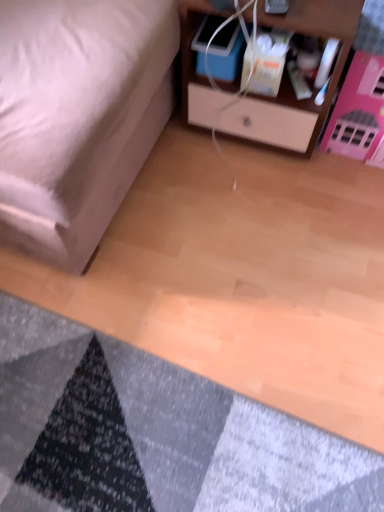
What is the approximate width of wooden nightstand at upper right?

The width of wooden nightstand at upper right is 15.46 inches.

Locate an element on the screen. The image size is (384, 512). textured gray mat at lower left is located at coordinates (156, 433).

At what (x,y) coordinates should I click in order to perform the action: click on wooden nightstand at upper right. Please return your answer as a coordinate pair (x, y). The image size is (384, 512). Looking at the image, I should click on (290, 83).

Is wooden nightstand at upper right positioned in front of textured gray mat at lower left?

No, the depth of wooden nightstand at upper right is greater than that of textured gray mat at lower left.

Considering the points (248, 100) and (38, 367), which point is behind, point (248, 100) or point (38, 367)?

The point (248, 100) is behind.

Consider the image. Does wooden nightstand at upper right have a smaller size compared to textured gray mat at lower left?

Actually, wooden nightstand at upper right might be larger than textured gray mat at lower left.

In terms of width, does wooden nightstand at upper right look wider or thinner when compared to matte white bed at lower left?

Considering their sizes, wooden nightstand at upper right looks slimmer than matte white bed at lower left.

Is wooden nightstand at upper right inside the boundaries of matte white bed at lower left, or outside?

wooden nightstand at upper right exists outside the volume of matte white bed at lower left.

Is wooden nightstand at upper right directly adjacent to matte white bed at lower left?

wooden nightstand at upper right is not next to matte white bed at lower left, and they're not touching.

From a real-world perspective, which object rests below the other?

textured gray mat at lower left, from a real-world perspective.

Considering the sizes of objects matte white bed at lower left and textured gray mat at lower left in the image provided, who is shorter, matte white bed at lower left or textured gray mat at lower left?

With less height is textured gray mat at lower left.

How different are the orientations of matte white bed at lower left and textured gray mat at lower left in degrees?

The facing directions of matte white bed at lower left and textured gray mat at lower left are 90.6 degrees apart.

Measure the distance from matte white bed at lower left to textured gray mat at lower left.

21.35 inches.

Is matte white bed at lower left facing away from wooden nightstand at upper right?

No, matte white bed at lower left's orientation is not away from wooden nightstand at upper right.

From their relative heights in the image, would you say matte white bed at lower left is taller or shorter than wooden nightstand at upper right?

matte white bed at lower left is taller than wooden nightstand at upper right.

From a real-world perspective, is matte white bed at lower left above or below wooden nightstand at upper right?

In terms of real-world spatial position, matte white bed at lower left is above wooden nightstand at upper right.

From the image's perspective, is matte white bed at lower left located beneath wooden nightstand at upper right?

No.

Locate an element on the screen. Image resolution: width=384 pixels, height=512 pixels. furniture to the left of textured gray mat at lower left is located at coordinates (78, 116).

Looking at this image, does textured gray mat at lower left lie behind matte white bed at lower left?

Yes, it is.

Are textured gray mat at lower left and matte white bed at lower left far apart?

Actually, textured gray mat at lower left and matte white bed at lower left are a little close together.

Is textured gray mat at lower left situated inside matte white bed at lower left or outside?

textured gray mat at lower left lies outside matte white bed at lower left.

How different are the orientations of textured gray mat at lower left and wooden nightstand at upper right in degrees?

2.64 degrees separate the facing orientations of textured gray mat at lower left and wooden nightstand at upper right.

Choose the correct answer: Is textured gray mat at lower left inside wooden nightstand at upper right or outside it?

textured gray mat at lower left is outside wooden nightstand at upper right.

Considering the sizes of objects textured gray mat at lower left and wooden nightstand at upper right in the image provided, who is taller, textured gray mat at lower left or wooden nightstand at upper right?

wooden nightstand at upper right is taller.

Where is `mat on the left of wooden nightstand at upper right`? mat on the left of wooden nightstand at upper right is located at coordinates (156, 433).

Where is `nightstand located underneath the matte white bed at lower left (from a real-world perspective)`? Image resolution: width=384 pixels, height=512 pixels. nightstand located underneath the matte white bed at lower left (from a real-world perspective) is located at coordinates (290, 83).

Estimate the real-world distances between objects in this image. Which object is further from textured gray mat at lower left, matte white bed at lower left or wooden nightstand at upper right?

Among the two, wooden nightstand at upper right is located further to textured gray mat at lower left.

Which object lies nearer to the anchor point wooden nightstand at upper right, matte white bed at lower left or textured gray mat at lower left?

Answer: matte white bed at lower left is closer to wooden nightstand at upper right.

Estimate the real-world distances between objects in this image. Which object is further from matte white bed at lower left, textured gray mat at lower left or wooden nightstand at upper right?

textured gray mat at lower left.

From the image, which object appears to be nearer to matte white bed at lower left, wooden nightstand at upper right or textured gray mat at lower left?

wooden nightstand at upper right lies closer to matte white bed at lower left than the other object.

When comparing their distances from wooden nightstand at upper right, does textured gray mat at lower left or matte white bed at lower left seem further?

textured gray mat at lower left is further to wooden nightstand at upper right.

From the image, which object appears to be farther from textured gray mat at lower left, wooden nightstand at upper right or matte white bed at lower left?

wooden nightstand at upper right is further to textured gray mat at lower left.

Find the location of `nightstand between matte white bed at lower left and textured gray mat at lower left vertically`. nightstand between matte white bed at lower left and textured gray mat at lower left vertically is located at coordinates (290, 83).